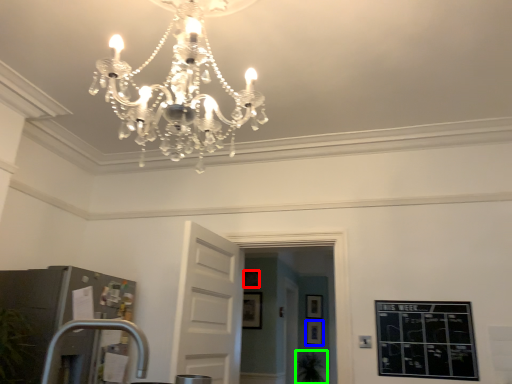
Question: Considering the real-world distances, which object is closest to picture frame (highlighted by a red box)? picture frame (highlighted by a blue box) or plant (highlighted by a green box).

Choices:
 (A) picture frame
 (B) plant

Answer: (A)